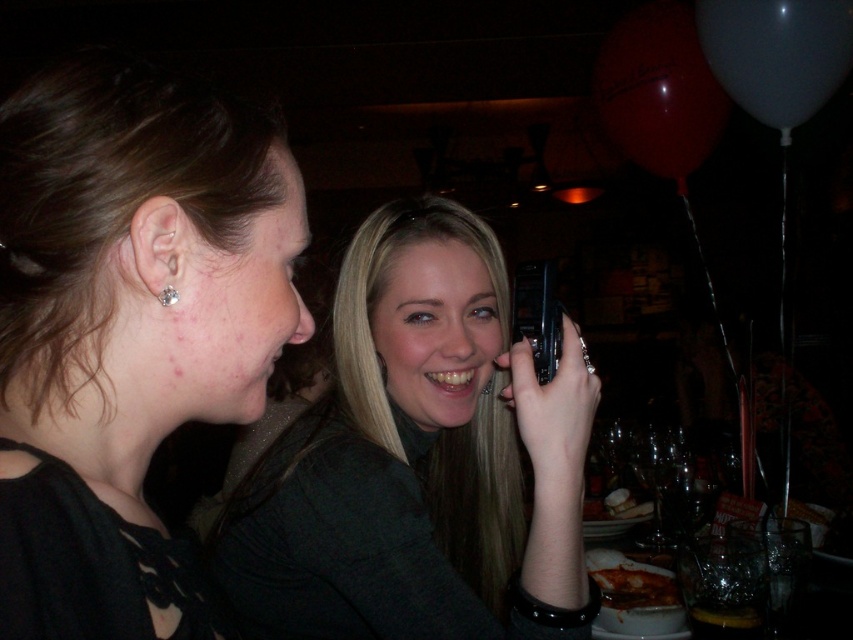
Question: Which of the following is the farthest from the observer?

Choices:
 (A) silver metallic earring at ear
 (B) black plastic phone at center

Answer: (B)

Question: Is matte silver earring at left positioned at the back of smooth gray shirt at center?

Choices:
 (A) no
 (B) yes

Answer: (A)

Question: Does smooth gray shirt at center appear under silver metallic earring at ear?

Choices:
 (A) no
 (B) yes

Answer: (B)

Question: Which of these objects is positioned closest to the smooth gray shirt at center?

Choices:
 (A) black plastic phone at center
 (B) matte silver earring at left

Answer: (A)

Question: Which point is closer to the camera taking this photo?

Choices:
 (A) (173, 289)
 (B) (548, 276)
 (C) (251, 496)
 (D) (33, 273)

Answer: (D)

Question: Can you confirm if matte silver earring at left is positioned to the left of smooth gray shirt at center?

Choices:
 (A) no
 (B) yes

Answer: (B)